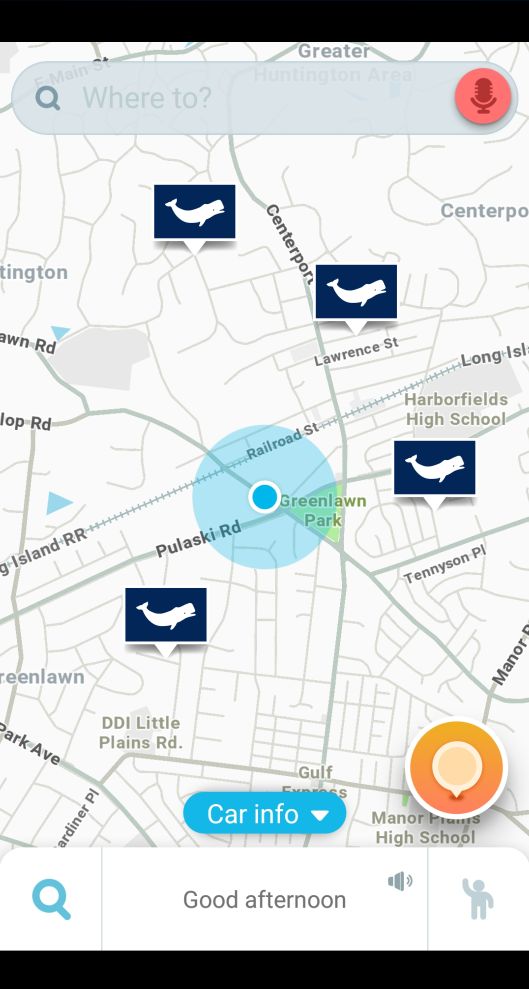
Find the location of a particular element. This screenshot has width=529, height=989. audio control is located at coordinates (398, 884).